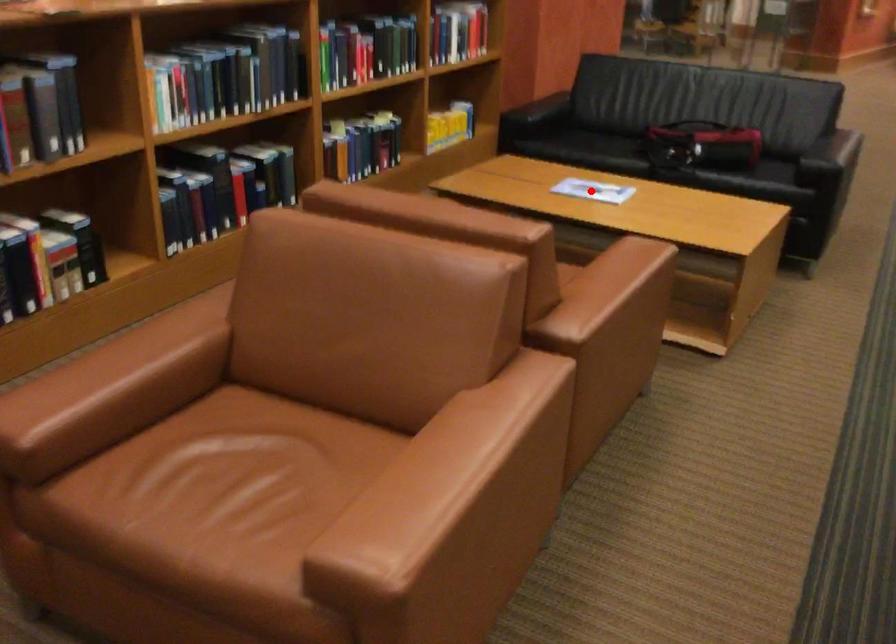
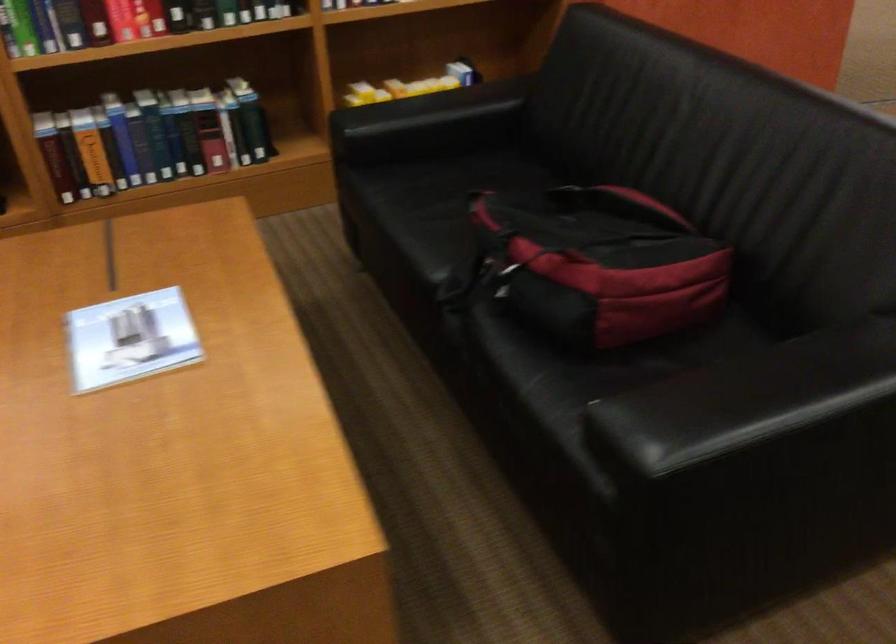
Question: A red point is marked in image1. In image2, is the corresponding 3D point closer to the camera or farther? Reply with the corresponding letter.

Choices:
 (A) The corresponding 3D point is closer.
 (B) The corresponding 3D point is farther.

Answer: (A)